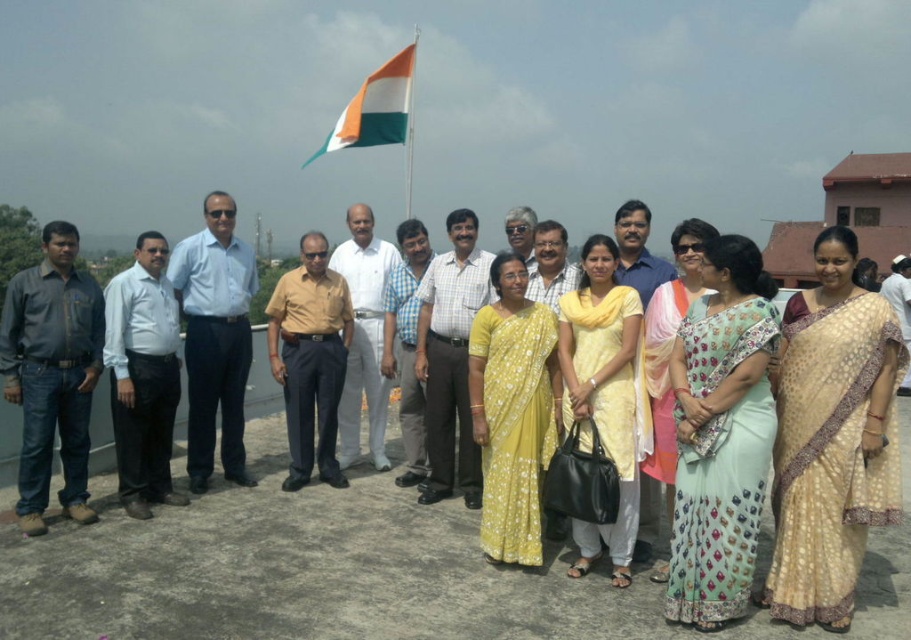
Question: Which object is farther from the camera taking this photo?

Choices:
 (A) tri-color fabric flag at upper center
 (B) light blue shirt at center
 (C) dark gray shirt at left
 (D) blue shirt at center

Answer: (A)

Question: Based on their relative distances, which object is farther from the white cotton shirt at center?

Choices:
 (A) yellow cotton shirt at center
 (B) dark gray shirt at left

Answer: (B)

Question: Among these points, which one is nearest to the camera?

Choices:
 (A) (517, 248)
 (B) (638, 532)

Answer: (B)

Question: Is blue shirt at center smaller than matte white shirt at center?

Choices:
 (A) no
 (B) yes

Answer: (A)

Question: Can you confirm if light blue shirt at center is bigger than light brown shirt at center?

Choices:
 (A) no
 (B) yes

Answer: (B)

Question: Can you confirm if checkered fabric shirt at center is positioned to the left of tri-color fabric flag at upper center?

Choices:
 (A) no
 (B) yes

Answer: (A)